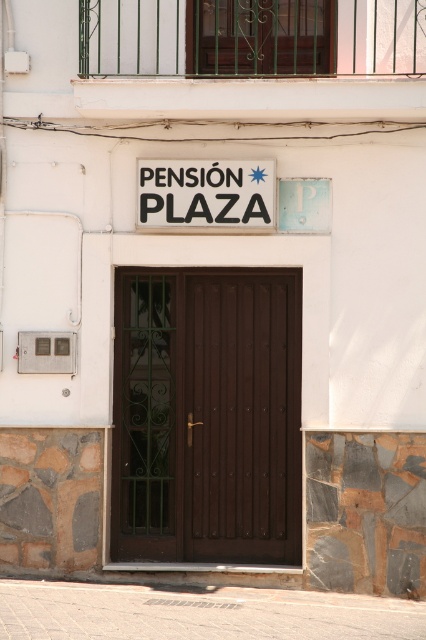
Does green wrought iron gate at upper center appear over matte plastic sign at center?

Yes.

Between point (192, 17) and point (175, 166), which one is positioned in front?

Point (175, 166) is more forward.

Between point (267, 1) and point (204, 212), which one is positioned behind?

The point (267, 1) is behind.

What are the coordinates of `green wrought iron gate at upper center` in the screenshot? It's located at (259, 36).

At what (x,y) coordinates should I click in order to perform the action: click on brown wooden door at center. Please return your answer as a coordinate pair (x, y). Looking at the image, I should click on (241, 417).

Is point (238, 560) closer to viewer compared to point (276, 1)?

No, (238, 560) is further to viewer.

Find the location of a particular element. The width and height of the screenshot is (426, 640). brown wooden door at center is located at coordinates (241, 417).

Between brown wooden door at center and matte plastic sign at center, which one appears on the right side from the viewer's perspective?

Positioned to the right is brown wooden door at center.

Is brown wooden door at center shorter than matte plastic sign at center?

No.

Who is more distant from viewer, (282, 321) or (253, 196)?

Point (282, 321)

Identify the location of brown wooden door at center. Image resolution: width=426 pixels, height=640 pixels. (241, 417).